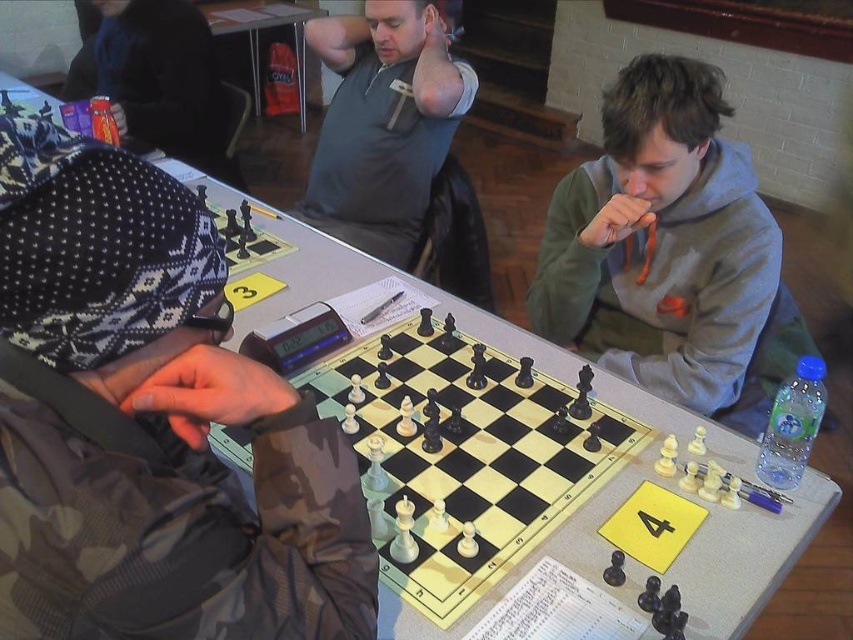
Question: Is gray matte shirt at center further to the viewer compared to dark blue knit hat at upper left?

Choices:
 (A) no
 (B) yes

Answer: (A)

Question: Which point appears farthest from the camera in this image?

Choices:
 (A) (395, 29)
 (B) (599, 243)
 (C) (123, 282)

Answer: (A)

Question: Which object appears closest to the camera in this image?

Choices:
 (A) gray matte shirt at center
 (B) camo fabric jacket at left
 (C) gray fleece hoodie at center
 (D) dark blue knit hat at upper left

Answer: (B)

Question: Estimate the real-world distances between objects in this image. Which object is closer to the camo fabric jacket at left?

Choices:
 (A) gray matte shirt at center
 (B) gray fleece hoodie at center

Answer: (B)

Question: Considering the relative positions of gray fleece hoodie at center and dark blue knit hat at upper left in the image provided, where is gray fleece hoodie at center located with respect to dark blue knit hat at upper left?

Choices:
 (A) above
 (B) below

Answer: (B)

Question: From the image, what is the correct spatial relationship of gray fleece hoodie at center in relation to dark blue knit hat at upper left?

Choices:
 (A) left
 (B) right

Answer: (B)